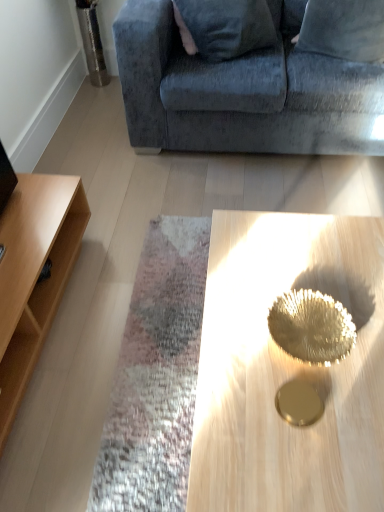
Question: Is gold metallic tray at center further to the viewer compared to velvet blue pillow at upper right?

Choices:
 (A) no
 (B) yes

Answer: (A)

Question: Does gold metallic tray at center have a greater height compared to velvet blue pillow at upper right?

Choices:
 (A) yes
 (B) no

Answer: (A)

Question: Considering the relative positions of gold metallic tray at center and velvet blue pillow at upper right in the image provided, is gold metallic tray at center in front of velvet blue pillow at upper right?

Choices:
 (A) no
 (B) yes

Answer: (B)

Question: From the image's perspective, is gold metallic tray at center beneath velvet blue pillow at upper right?

Choices:
 (A) yes
 (B) no

Answer: (A)

Question: Is gold metallic tray at center looking in the opposite direction of velvet blue pillow at upper right?

Choices:
 (A) no
 (B) yes

Answer: (A)

Question: Is velvet blue couch at upper center to the left or to the right of gold metallic tray at center in the image?

Choices:
 (A) right
 (B) left

Answer: (A)

Question: Is velvet blue couch at upper center wider or thinner than gold metallic tray at center?

Choices:
 (A) wide
 (B) thin

Answer: (A)

Question: Is velvet blue couch at upper center inside the boundaries of gold metallic tray at center, or outside?

Choices:
 (A) inside
 (B) outside

Answer: (B)

Question: Does point (374, 80) appear closer or farther from the camera than point (248, 230)?

Choices:
 (A) closer
 (B) farther

Answer: (B)

Question: Based on their positions, is velvet blue pillow at upper right located to the left or right of light wood shelf at left?

Choices:
 (A) left
 (B) right

Answer: (B)

Question: From the image's perspective, is velvet blue pillow at upper right positioned above or below light wood shelf at left?

Choices:
 (A) below
 (B) above

Answer: (B)

Question: Considering the positions of velvet blue pillow at upper right and light wood shelf at left in the image, is velvet blue pillow at upper right bigger or smaller than light wood shelf at left?

Choices:
 (A) big
 (B) small

Answer: (B)

Question: In terms of width, does velvet blue pillow at upper right look wider or thinner when compared to light wood shelf at left?

Choices:
 (A) thin
 (B) wide

Answer: (A)

Question: In the image, is light wood shelf at left positioned in front of or behind gold metallic tray at center?

Choices:
 (A) behind
 (B) front

Answer: (A)

Question: Is light wood shelf at left bigger or smaller than gold metallic tray at center?

Choices:
 (A) small
 (B) big

Answer: (A)